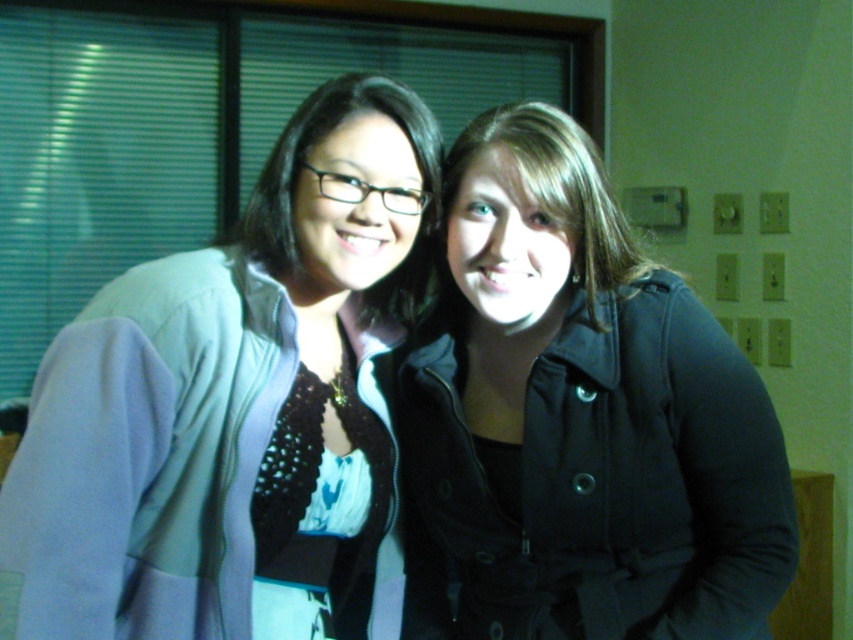
You are taking a photo of two people standing in a room with a camera that has a depth sensor. The camera detects two points of interest labeled as point (x=456, y=528) and point (x=372, y=296). Based on the scene description, which point is closer to the camera?

Point (x=456, y=528) is closer to the camera than point (x=372, y=296) according to the description.

You are an interior designer creating a layout for a small room. You need to place a matte purple jacket at left in the room. Where should you position it based on the coordinates provided?

The matte purple jacket at left should be positioned at the coordinates point (x=236, y=410) as specified.